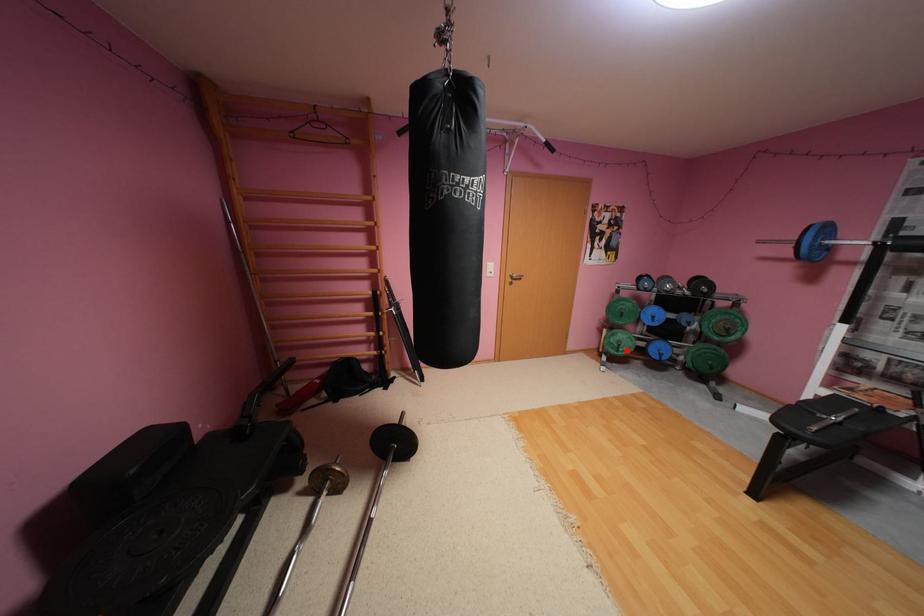
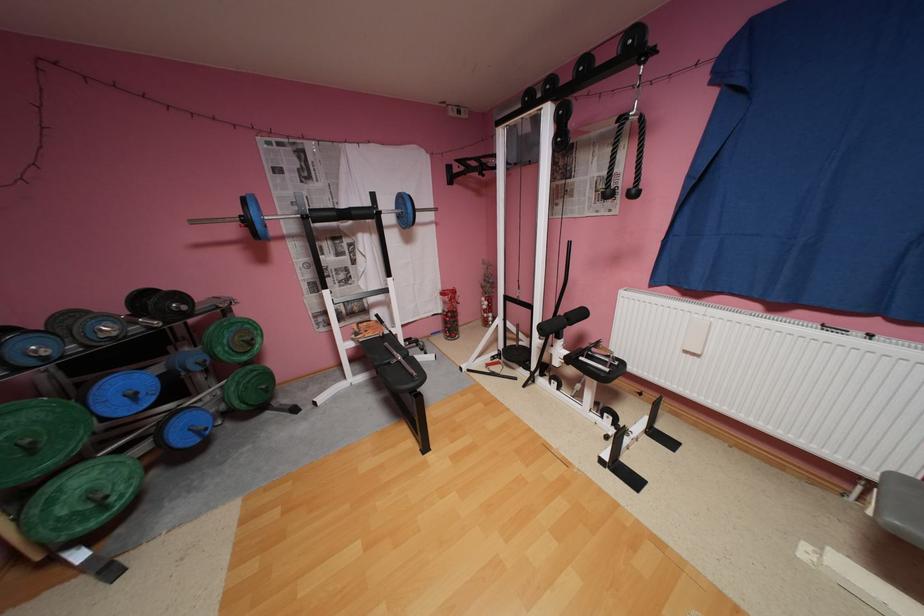
Question: A red point is marked in image1. In image2, is the corresponding 3D point closer to the camera or farther? Reply with the corresponding letter.

Choices:
 (A) The corresponding 3D point is closer.
 (B) The corresponding 3D point is farther.

Answer: (A)